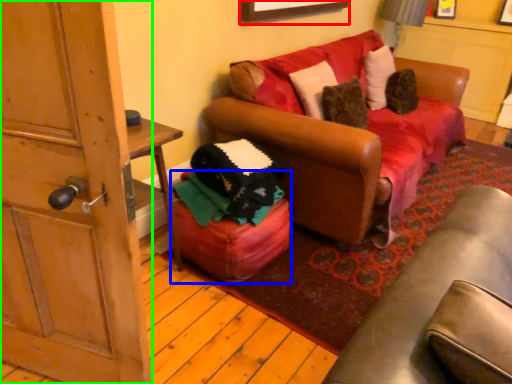
Question: Estimate the real-world distances between objects in this image. Which object is farther from picture frame (highlighted by a red box), stool (highlighted by a blue box) or door (highlighted by a green box)?

Choices:
 (A) stool
 (B) door

Answer: (B)